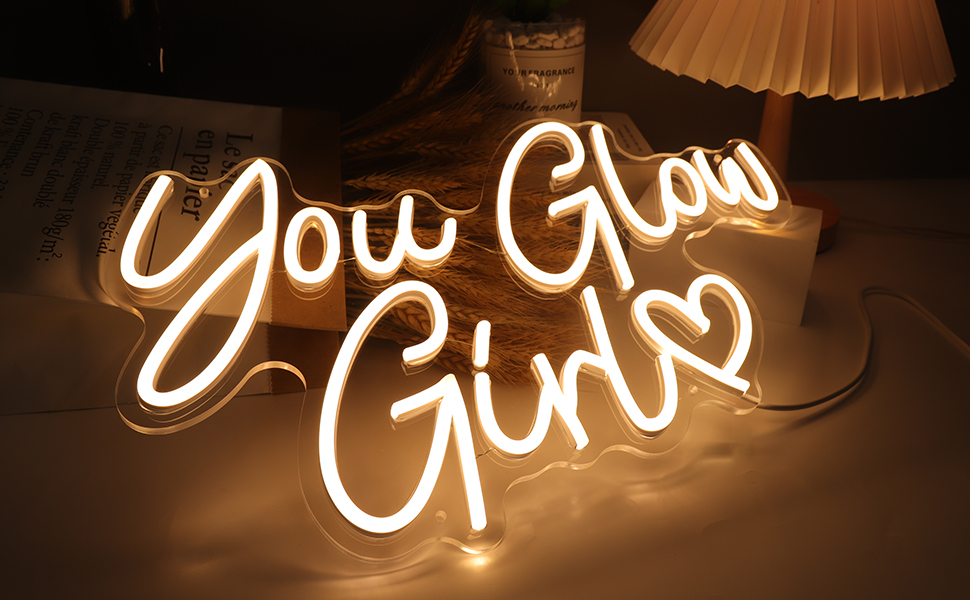
You are a GUI agent. You are given a task and a screenshot of the screen. Output one action in this format:
    pyautogui.click(x=<x>, y=<y>)
    Task: Click on the box
    
    Given the screenshot: What is the action you would take?
    pyautogui.click(x=72, y=347)